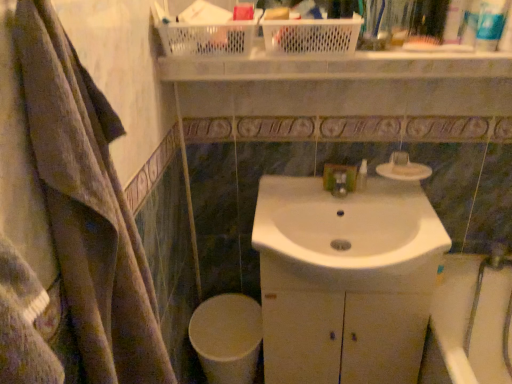
Locate an element on the screen. blue plastic toothbrush at upper right, the 1th toiletry when ordered from front to back is located at coordinates (506, 33).

How much space does translucent plastic bottle at upper right, which is the second toiletry in back-to-front order, occupy horizontally?

4.91 centimeters.

Describe the element at coordinates (343, 323) in the screenshot. The height and width of the screenshot is (384, 512). I see `white glossy cabinet at center` at that location.

In order to face white plastic toothpaste tube at upper right, the second toiletry in the right-to-left sequence, should I rotate leftwards or rightwards?

It's best to rotate right around 28.921 degrees.

You are a GUI agent. You are given a task and a screenshot of the screen. Output one action in this format:
    pyautogui.click(x=<x>, y=<y>)
    Task: Click on the blue plastic toothbrush at upper right, the 3th toiletry positioned from the bottom
    This screenshot has height=384, width=512.
    Given the screenshot: What is the action you would take?
    pyautogui.click(x=506, y=33)

Which is more to the left, white plastic toothpaste tube at upper right, which ranks as the 3th toiletry in top-to-bottom order, or blue plastic toothbrush at upper right, arranged as the first toiletry when viewed from the right?

Positioned to the left is white plastic toothpaste tube at upper right, which ranks as the 3th toiletry in top-to-bottom order.

Can you confirm if white plastic toothpaste tube at upper right, the second toiletry from the bottom, is wider than blue plastic toothbrush at upper right, which is the 2th toiletry in top-to-bottom order?

No.

Is white plastic toothpaste tube at upper right, the 3th toiletry positioned from the left, in front of or behind blue plastic toothbrush at upper right, placed as the fourth toiletry when sorted from left to right, in the image?

white plastic toothpaste tube at upper right, the 3th toiletry positioned from the left, is behind blue plastic toothbrush at upper right, placed as the fourth toiletry when sorted from left to right.

Can you confirm if white plastic toothpaste tube at upper right, which is the second toiletry from front to back, is bigger than blue plastic toothbrush at upper right, placed as the fourth toiletry when sorted from left to right?

No, white plastic toothpaste tube at upper right, which is the second toiletry from front to back, is not bigger than blue plastic toothbrush at upper right, placed as the fourth toiletry when sorted from left to right.

Is white glossy bath at lower right oriented away from green matte soap dispenser at center, which is the fourth toiletry from top to bottom?

No.

From a real-world perspective, which is physically above, white glossy bath at lower right or green matte soap dispenser at center, which is the fourth toiletry from top to bottom?

green matte soap dispenser at center, which is the fourth toiletry from top to bottom.

At what (x,y) coordinates should I click in order to perform the action: click on the 1st toiletry above the white glossy bath at lower right (from a real-world perspective). Please return your answer as a coordinate pair (x, y). Looking at the image, I should click on (362, 175).

Is white plastic basket at upper center, arranged as the 1th basket when viewed from the right, positioned with its back to blue plastic toothbrush at upper right, the 1th toiletry when ordered from front to back?

No, white plastic basket at upper center, arranged as the 1th basket when viewed from the right, is not facing the opposite direction of blue plastic toothbrush at upper right, the 1th toiletry when ordered from front to back.

In terms of height, does white plastic basket at upper center, which is the 2th basket from left to right, look taller or shorter compared to blue plastic toothbrush at upper right, placed as the fourth toiletry when sorted from left to right?

Clearly, white plastic basket at upper center, which is the 2th basket from left to right, is shorter compared to blue plastic toothbrush at upper right, placed as the fourth toiletry when sorted from left to right.

Between white plastic basket at upper center, which is the 2th basket from left to right, and blue plastic toothbrush at upper right, which is counted as the 4th toiletry, starting from the back, which one is positioned behind?

white plastic basket at upper center, which is the 2th basket from left to right, is more distant.

Based on the photo, is white plastic basket at upper center, arranged as the 1th basket when viewed from the right, bigger or smaller than blue plastic toothbrush at upper right, the 3th toiletry positioned from the bottom?

white plastic basket at upper center, arranged as the 1th basket when viewed from the right, is bigger than blue plastic toothbrush at upper right, the 3th toiletry positioned from the bottom.

From their relative heights in the image, would you say green matte soap dispenser at center, which is the first toiletry from bottom to top, is taller or shorter than blue plastic toothbrush at upper right, which is counted as the 4th toiletry, starting from the back?

Considering their sizes, green matte soap dispenser at center, which is the first toiletry from bottom to top, has less height than blue plastic toothbrush at upper right, which is counted as the 4th toiletry, starting from the back.

Based on the photo, from a real-world perspective, which is physically above, green matte soap dispenser at center, the 1th toiletry viewed from the back, or blue plastic toothbrush at upper right, which is counted as the 4th toiletry, starting from the back?

blue plastic toothbrush at upper right, which is counted as the 4th toiletry, starting from the back, from a real-world perspective.

Is green matte soap dispenser at center, acting as the fourth toiletry starting from the right, wider than blue plastic toothbrush at upper right, arranged as the first toiletry when viewed from the right?

Correct, the width of green matte soap dispenser at center, acting as the fourth toiletry starting from the right, exceeds that of blue plastic toothbrush at upper right, arranged as the first toiletry when viewed from the right.

From the image's perspective, between white glossy toilet bowl at lower center and white glossy bath at lower right, which one is located above?

white glossy bath at lower right is shown above in the image.

In terms of width, does white glossy toilet bowl at lower center look wider or thinner when compared to white glossy bath at lower right?

In the image, white glossy toilet bowl at lower center appears to be more narrow than white glossy bath at lower right.

Consider the image. Is white glossy toilet bowl at lower center oriented towards white glossy bath at lower right?

No, white glossy toilet bowl at lower center is not aimed at white glossy bath at lower right.

Is white glossy cabinet at center spatially inside white plastic basket at upper center, which is the 2th basket from left to right, or outside of it?

white glossy cabinet at center exists outside the volume of white plastic basket at upper center, which is the 2th basket from left to right.

Is white glossy cabinet at center facing away from white plastic basket at upper center, which is the 2th basket from left to right?

white glossy cabinet at center is not turned away from white plastic basket at upper center, which is the 2th basket from left to right.

At what (x,y) coordinates should I click in order to perform the action: click on bathroom cabinet lying below the white plastic basket at upper center, arranged as the 1th basket when viewed from the right (from the image's perspective). Please return your answer as a coordinate pair (x, y). Looking at the image, I should click on (343, 323).

Where is `bath towel above the white matte soap at upper center (from a real-world perspective)`? This screenshot has height=384, width=512. bath towel above the white matte soap at upper center (from a real-world perspective) is located at coordinates (66, 220).

From the image's perspective, who appears lower, white textured bath towel at left or white matte soap at upper center?

From the image's view, white textured bath towel at left is below.

How much distance is there between white textured bath towel at left and white matte soap at upper center?

They are 37.71 inches apart.

In the scene shown: Is white matte soap at upper center surrounded by white textured bath towel at left?

Definitely not — white matte soap at upper center is not inside white textured bath towel at left.

From the blue plastic toothbrush at upper right, arranged as the first toiletry when viewed from the right, count the 1st toiletry to the left and point to it. Please provide its 2D coordinates.

[(490, 24)]

This screenshot has height=384, width=512. What are the coordinates of `bath located underneath the green matte soap dispenser at center, arranged as the first toiletry when viewed from the left (from a real-world perspective)` in the screenshot? It's located at (472, 319).

From the image, which object appears to be farther from translucent plastic bottle at upper right, the 2th toiletry from the left, white plastic toothpaste tube at upper right, which is the second toiletry from front to back, or white plastic basket at upper center, arranged as the 1th basket when viewed from the right?

Based on the image, white plastic basket at upper center, arranged as the 1th basket when viewed from the right, appears to be further to translucent plastic bottle at upper right, the 2th toiletry from the left.

Estimate the real-world distances between objects in this image. Which object is closer to white plastic basket at upper center, which is the 2th basket from left to right, white glossy sink at center or white textured bath towel at left?

The object closer to white plastic basket at upper center, which is the 2th basket from left to right, is white glossy sink at center.

In the scene shown: Considering their positions, is white plastic basket at upper center positioned closer to white plastic basket at upper center, the first basket positioned from the left, than white glossy toilet bowl at lower center?

The object closer to white plastic basket at upper center, the first basket positioned from the left, is white plastic basket at upper center.

Estimate the real-world distances between objects in this image. Which object is further from white glossy sink at center, translucent plastic bottle at upper right, which ranks as the third toiletry in front-to-back order, or white glossy cabinet at center?

Based on the image, translucent plastic bottle at upper right, which ranks as the third toiletry in front-to-back order, appears to be further to white glossy sink at center.

Based on their spatial positions, is white plastic basket at upper center, arranged as the 1th basket when viewed from the right, or white glossy cabinet at center further from white matte soap at upper center?

white glossy cabinet at center is further to white matte soap at upper center.

Considering their positions, is white plastic basket at upper center, which is the 2th basket from left to right, positioned further to white plastic basket at upper center, positioned as the second basket in right-to-left order, than translucent plastic bottle at upper right, acting as the first toiletry starting from the top?

translucent plastic bottle at upper right, acting as the first toiletry starting from the top, is positioned further to the anchor white plastic basket at upper center, positioned as the second basket in right-to-left order.

From the image, which object appears to be nearer to white matte soap at upper center, white plastic basket at upper center, positioned as the second basket in right-to-left order, or white glossy bath at lower right?

white glossy bath at lower right is closer to white matte soap at upper center.

Looking at the image, which one is located further to translucent plastic bottle at upper right, which is the second toiletry in back-to-front order, white glossy cabinet at center or white textured bath towel at left?

white textured bath towel at left is positioned further to the anchor translucent plastic bottle at upper right, which is the second toiletry in back-to-front order.

Find the location of a particular element. The height and width of the screenshot is (384, 512). bathroom cabinet between white plastic basket at upper center, which is the 2th basket from left to right, and white glossy toilet bowl at lower center from top to bottom is located at coordinates (343, 323).

Find the location of a particular element. Image resolution: width=512 pixels, height=384 pixels. bathroom cabinet between white glossy sink at center and white glossy bath at lower right from left to right is located at coordinates [343, 323].

At what (x,y) coordinates should I click in order to perform the action: click on counter top between translucent plastic bottle at upper right, which is the second toiletry in back-to-front order, and white glossy toilet bowl at lower center in the up-down direction. Please return your answer as a coordinate pair (x, y). Looking at the image, I should click on (341, 66).

Locate an element on the screen. soap between white plastic basket at upper center and white glossy bath at lower right in the vertical direction is located at coordinates (410, 170).